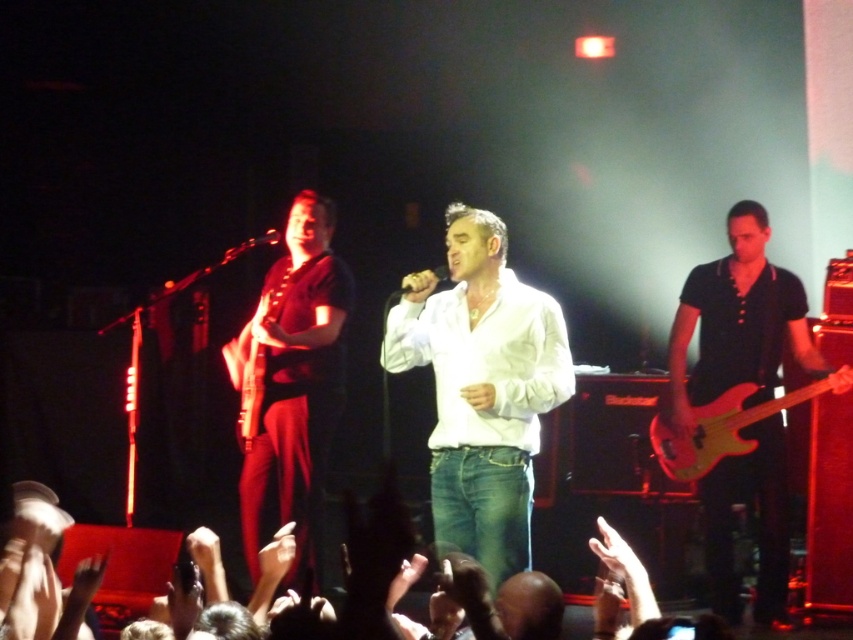
Question: Does white matte shirt at center appear under matte red electric bass at right?

Choices:
 (A) no
 (B) yes

Answer: (A)

Question: Considering the real-world distances, which object is farthest from the white matte shirt at center?

Choices:
 (A) matte red electric bass at right
 (B) matte black guitar at left
 (C) matte black bass guitar at right
 (D) wooden electric guitar at center

Answer: (C)

Question: Does white matte shirt at center have a smaller size compared to matte red electric bass at right?

Choices:
 (A) no
 (B) yes

Answer: (A)

Question: Among these objects, which one is nearest to the camera?

Choices:
 (A) white matte shirt at center
 (B) matte black bass guitar at right

Answer: (A)

Question: Is matte black guitar at left positioned at the back of wooden electric guitar at center?

Choices:
 (A) yes
 (B) no

Answer: (B)

Question: Estimate the real-world distances between objects in this image. Which object is closer to the white matte shirt at center?

Choices:
 (A) matte red electric bass at right
 (B) matte black guitar at left
 (C) wooden electric guitar at center
 (D) matte black bass guitar at right

Answer: (B)